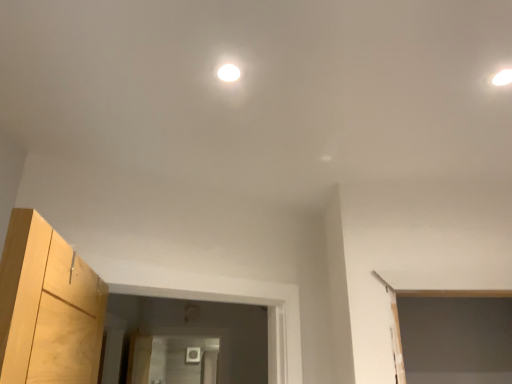
This screenshot has height=384, width=512. I want to click on white glossy door at center, so click(x=209, y=367).

Image resolution: width=512 pixels, height=384 pixels. Describe the element at coordinates (209, 367) in the screenshot. I see `white glossy door at center` at that location.

Locate an element on the screen. The width and height of the screenshot is (512, 384). white glossy door at center is located at coordinates (209, 367).